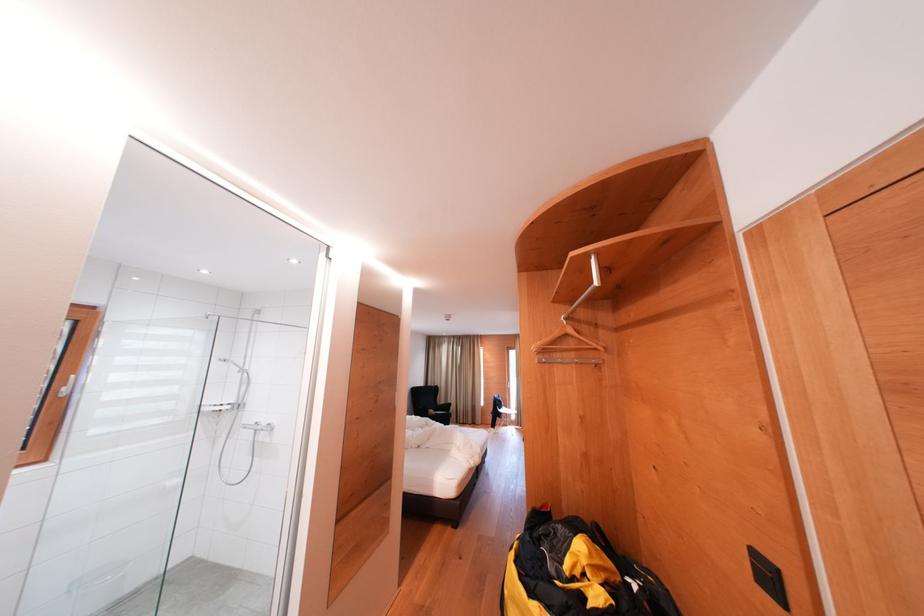
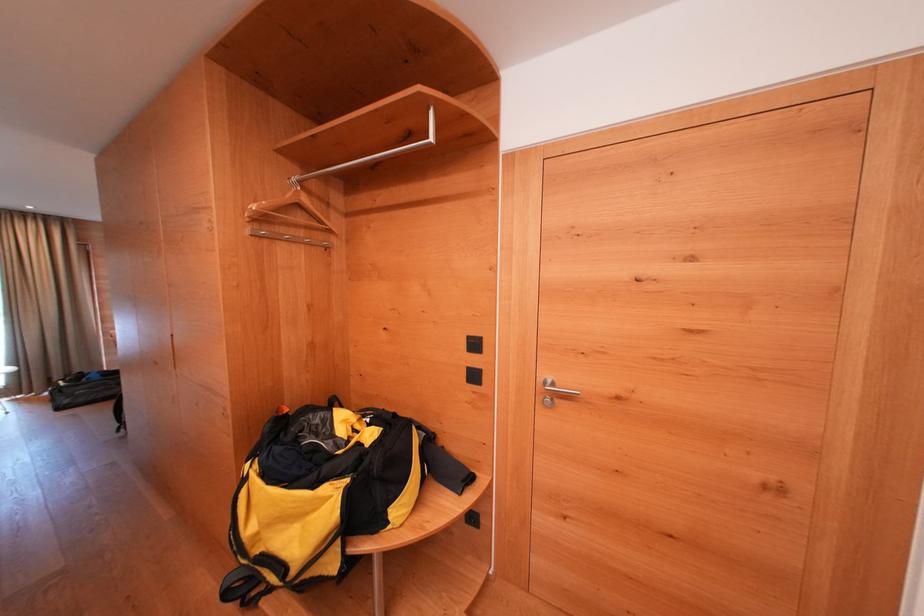
Where in the second image is the point corresponding to pixel 776 582 from the first image?

(481, 349)